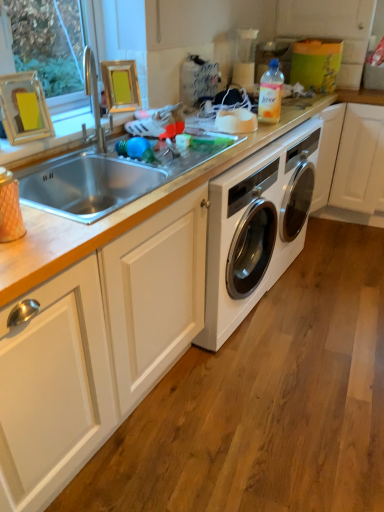
Question: Is silver metallic sink at upper left oriented away from translucent plastic bottle at upper right?

Choices:
 (A) yes
 (B) no

Answer: (B)

Question: From the image's perspective, is silver metallic sink at upper left located above translucent plastic bottle at upper right?

Choices:
 (A) yes
 (B) no

Answer: (B)

Question: From the image's perspective, is silver metallic sink at upper left below translucent plastic bottle at upper right?

Choices:
 (A) no
 (B) yes

Answer: (B)

Question: Could you tell me if silver metallic sink at upper left is facing translucent plastic bottle at upper right?

Choices:
 (A) yes
 (B) no

Answer: (B)

Question: Is silver metallic sink at upper left not inside translucent plastic bottle at upper right?

Choices:
 (A) no
 (B) yes

Answer: (B)

Question: Can you confirm if silver metallic sink at upper left is shorter than translucent plastic bottle at upper right?

Choices:
 (A) no
 (B) yes

Answer: (A)

Question: Considering the relative sizes of white glossy washing machine at center and translucent plastic bottle at upper right in the image provided, is white glossy washing machine at center taller than translucent plastic bottle at upper right?

Choices:
 (A) no
 (B) yes

Answer: (B)

Question: Is white glossy washing machine at center positioned before translucent plastic bottle at upper right?

Choices:
 (A) yes
 (B) no

Answer: (B)

Question: Are white glossy washing machine at center and translucent plastic bottle at upper right making contact?

Choices:
 (A) yes
 (B) no

Answer: (B)

Question: From the image's perspective, would you say white glossy washing machine at center is shown under translucent plastic bottle at upper right?

Choices:
 (A) yes
 (B) no

Answer: (A)

Question: From the image's perspective, would you say white glossy washing machine at center is positioned over translucent plastic bottle at upper right?

Choices:
 (A) no
 (B) yes

Answer: (A)

Question: Is translucent plastic bottle at upper right a part of white glossy washing machine at center?

Choices:
 (A) yes
 (B) no

Answer: (B)

Question: Does white matte cabinet at center have a lesser width compared to silver metallic sink at upper left?

Choices:
 (A) no
 (B) yes

Answer: (A)